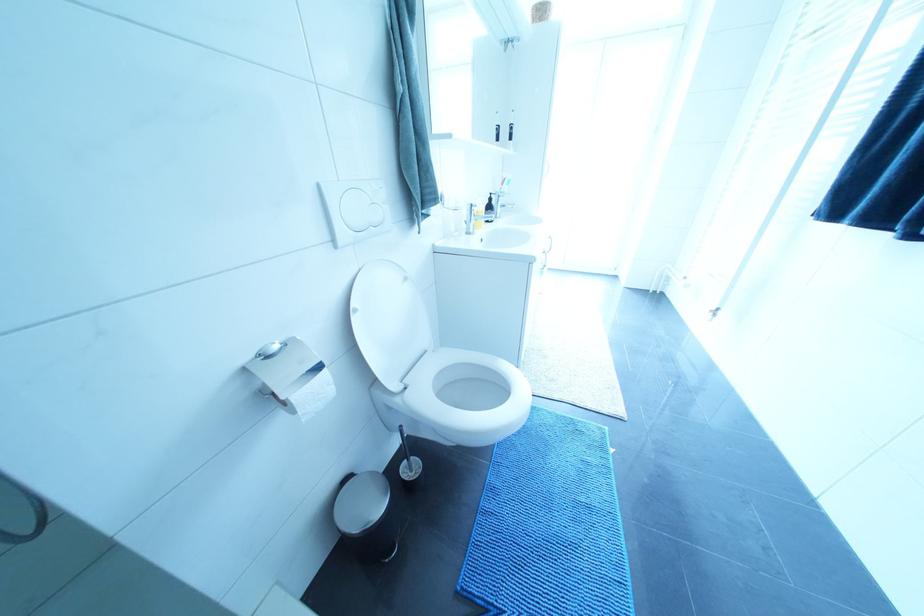
Where would you lift the toilet brush handle? Please return your answer as a coordinate pair (x, y).

(404, 442)